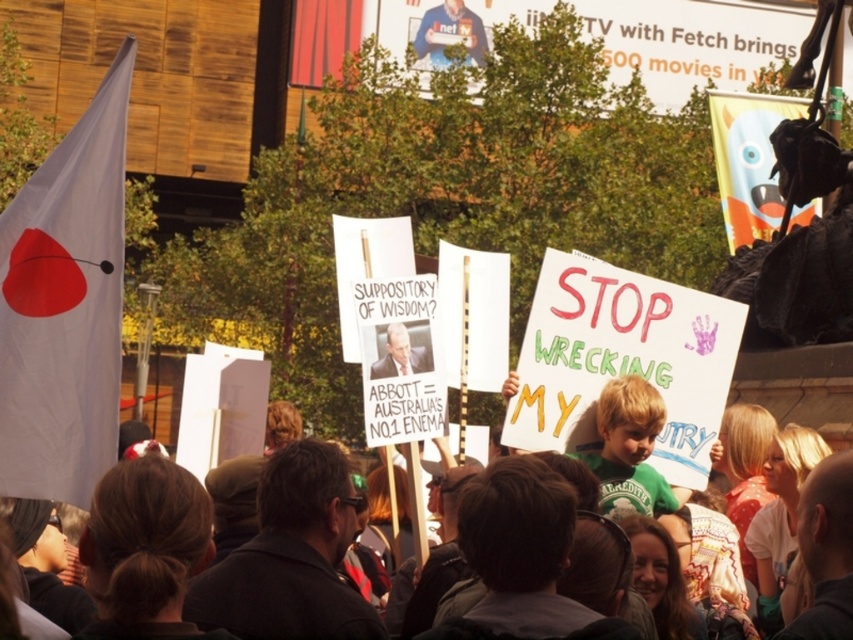
Does matte plastic flag at upper right appear on the right side of smooth plastic sign at center?

Indeed, matte plastic flag at upper right is positioned on the right side of smooth plastic sign at center.

The image size is (853, 640). I want to click on matte plastic flag at upper right, so click(x=747, y=161).

Does white fabric flag at left have a lesser width compared to matte plastic flag at upper right?

Correct, white fabric flag at left's width is less than matte plastic flag at upper right's.

Measure the distance from white fabric flag at left to matte plastic flag at upper right.

white fabric flag at left and matte plastic flag at upper right are 155.56 feet apart from each other.

Which is in front, point (51, 300) or point (757, 99)?

Positioned in front is point (51, 300).

Locate an element on the screen. white fabric flag at left is located at coordinates (65, 305).

Looking at this image, is matte plastic flag at upper right thinner than blue shirt at upper center?

Incorrect, matte plastic flag at upper right's width is not less than blue shirt at upper center's.

Does matte plastic flag at upper right have a larger size compared to blue shirt at upper center?

Indeed, matte plastic flag at upper right has a larger size compared to blue shirt at upper center.

Between point (788, 102) and point (440, 60), which one is positioned behind?

Point (440, 60)

The width and height of the screenshot is (853, 640). What are the coordinates of `matte plastic flag at upper right` in the screenshot? It's located at (747, 161).